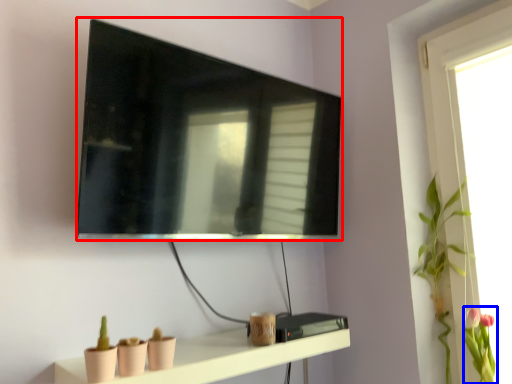
Question: Which of the following is the closest to the observer, television (highlighted by a red box) or floral arrangement (highlighted by a blue box)?

Choices:
 (A) television
 (B) floral arrangement

Answer: (A)